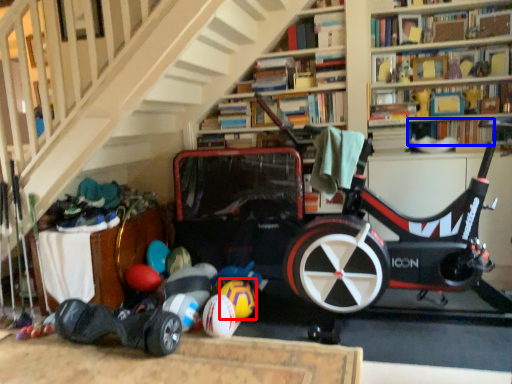
Question: Which object appears closest to the camera in this image, beach ball (highlighted by a red box) or book (highlighted by a blue box)?

Choices:
 (A) beach ball
 (B) book

Answer: (A)